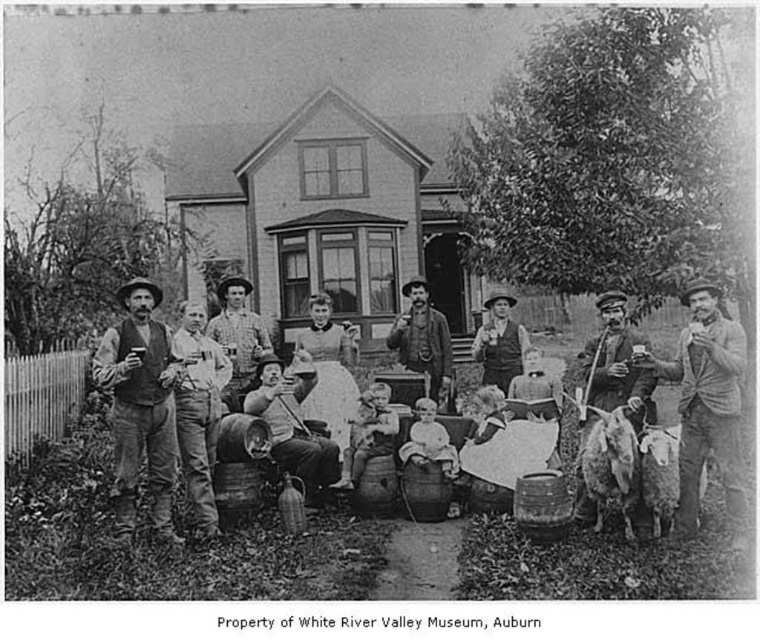
Question: From the image, what is the correct spatial relationship of smooth wooden pipe at right in relation to smooth white baby at center?

Choices:
 (A) below
 (B) above

Answer: (B)

Question: Is smooth leather jacket at right below smooth white baby at center?

Choices:
 (A) no
 (B) yes

Answer: (B)

Question: Which point is farther to the camera?

Choices:
 (A) (239, 369)
 (B) (727, 481)
 (C) (432, 442)

Answer: (A)

Question: Does matte black vest at center appear over smooth leather jacket at right?

Choices:
 (A) yes
 (B) no

Answer: (A)

Question: Which point is farther to the camera?

Choices:
 (A) smooth wooden pipe at right
 (B) smooth wooden chair at center

Answer: (B)

Question: Considering the real-world distances, which object is farthest from the smooth wooden chair at center?

Choices:
 (A) rough wooden barrel at center
 (B) smooth wooden pipe at right
 (C) matte black vest at center
 (D) smooth wooden barrel at center

Answer: (C)